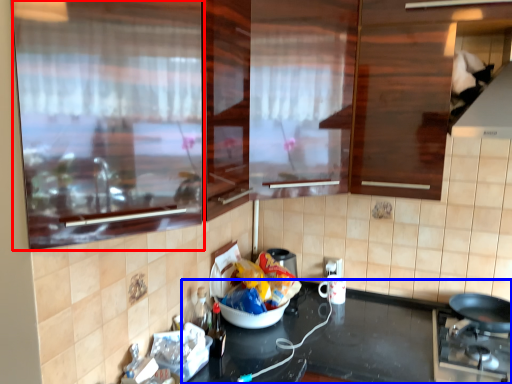
Question: Among these objects, which one is farthest to the camera, glass door (highlighted by a red box) or countertop (highlighted by a blue box)?

Choices:
 (A) glass door
 (B) countertop

Answer: (B)